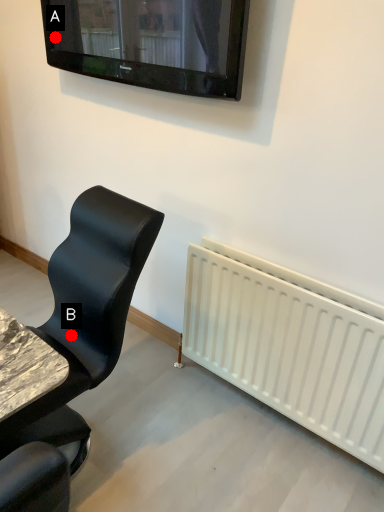
Question: Two points are circled on the image, labeled by A and B beside each circle. Among these points, which one is nearest to the camera?

Choices:
 (A) A is closer
 (B) B is closer

Answer: (B)